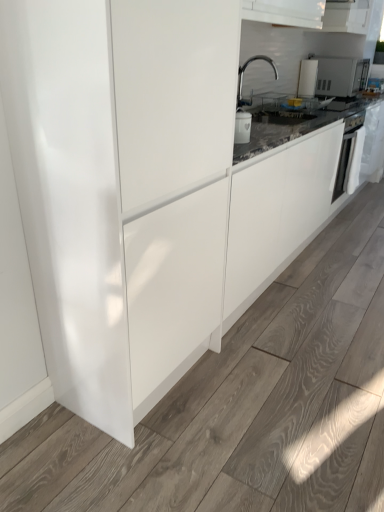
Question: In terms of width, does white glossy microwave at upper right look wider or thinner when compared to white glossy microwave at upper right?

Choices:
 (A) thin
 (B) wide

Answer: (A)

Question: Visually, is white glossy microwave at upper right positioned to the left or to the right of white glossy microwave at upper right?

Choices:
 (A) left
 (B) right

Answer: (A)

Question: Based on their relative distances, which object is farther from the white glossy microwave at upper right?

Choices:
 (A) glossy white cabinet at center
 (B) white glossy microwave at upper right
 (C) white glossy oven at right
 (D) polished chrome faucet at upper center

Answer: (A)

Question: Estimate the real-world distances between objects in this image. Which object is farther from the white glossy microwave at upper right?

Choices:
 (A) glossy white cabinet at center
 (B) white glossy microwave at upper right
 (C) white glossy oven at right
 (D) polished chrome faucet at upper center

Answer: (A)